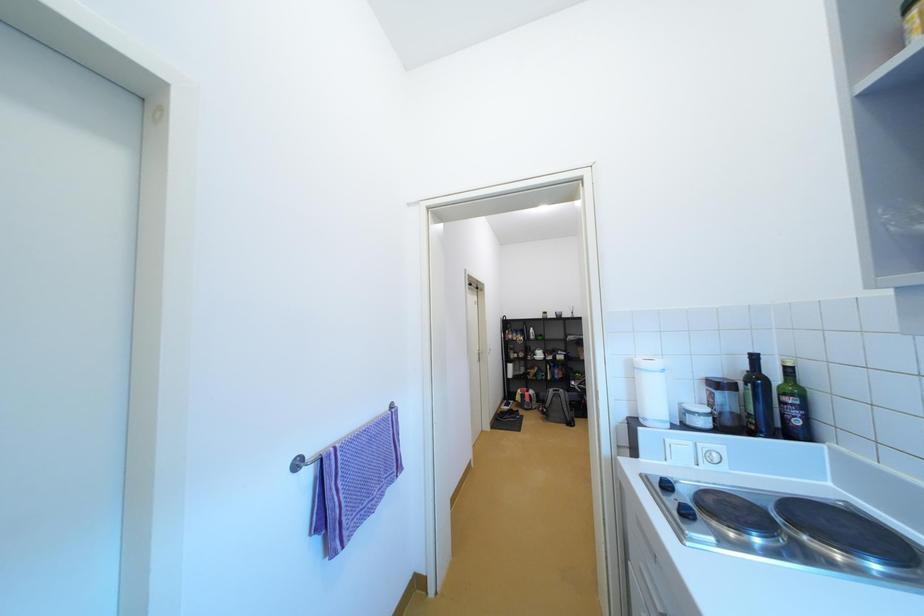
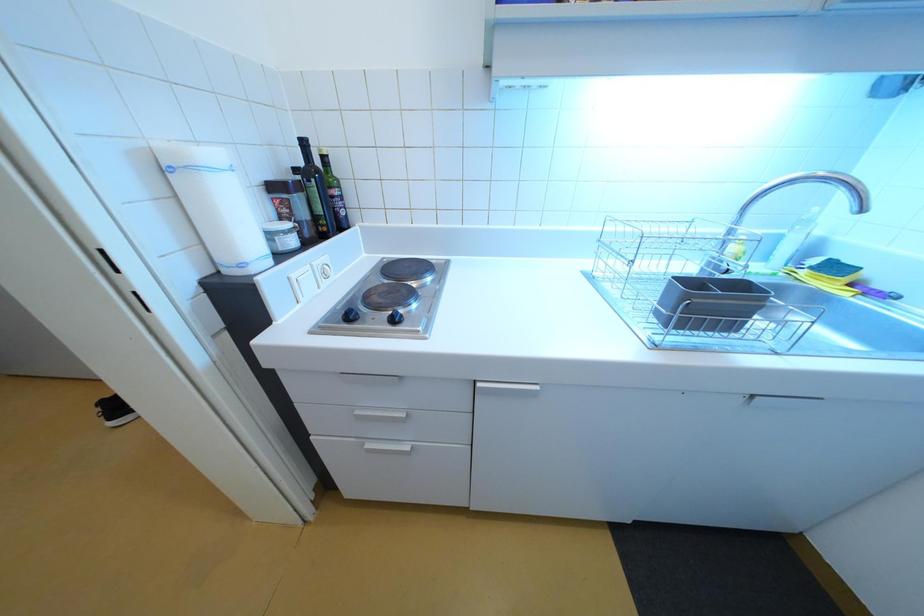
The images are taken continuously from a first-person perspective. In which direction is your viewpoint rotating?

The camera's rotation is toward right-down.